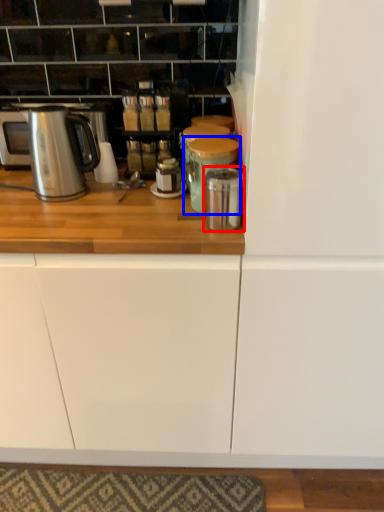
Question: Which object is further to the camera taking this photo, appliance (highlighted by a red box) or appliance (highlighted by a blue box)?

Choices:
 (A) appliance
 (B) appliance

Answer: (B)